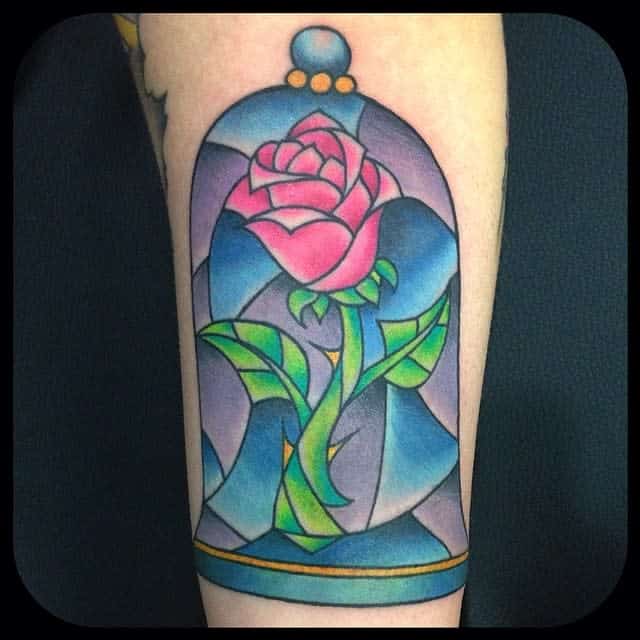
Locate an element on the screen. handle is located at coordinates (326, 61).